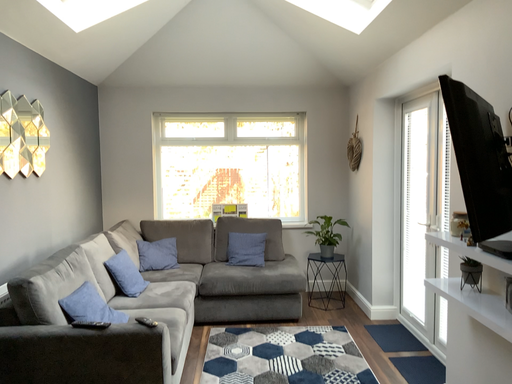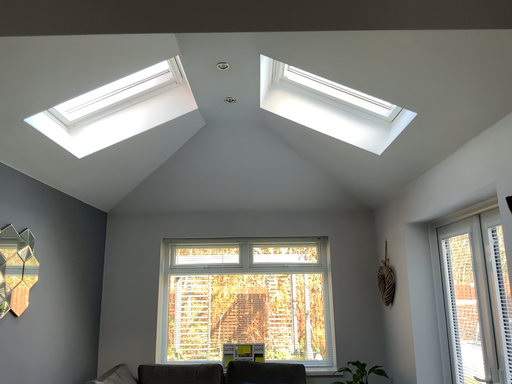
Question: How did the camera likely rotate when shooting the video?

Choices:
 (A) rotated upward
 (B) rotated downward

Answer: (A)